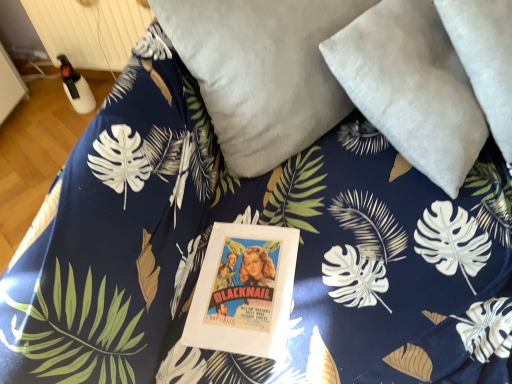
In order to click on suede-like gray pillow at upper right, the first pillow positioned from the right in this screenshot , I will do `click(411, 87)`.

This screenshot has height=384, width=512. What do you see at coordinates (411, 87) in the screenshot? I see `suede-like gray pillow at upper right, the second pillow from the left` at bounding box center [411, 87].

In order to click on white plastic radiator at upper left in this screenshot , I will do `click(89, 30)`.

Locate an element on the screen. This screenshot has width=512, height=384. velvety gray pillow at upper center, marked as the 1th pillow in a left-to-right arrangement is located at coordinates (261, 72).

Is velvety gray pillow at upper center, marked as the 1th pillow in a left-to-right arrangement, oriented towards white plastic radiator at upper left?

No, velvety gray pillow at upper center, marked as the 1th pillow in a left-to-right arrangement, is not facing towards white plastic radiator at upper left.

What's the angular difference between velvety gray pillow at upper center, the second pillow in the right-to-left sequence, and white plastic radiator at upper left's facing directions?

They differ by 46.6 degrees in their facing directions.

Which object is further away from the camera taking this photo, velvety gray pillow at upper center, marked as the 1th pillow in a left-to-right arrangement, or white plastic radiator at upper left?

white plastic radiator at upper left is further from the camera.

Can you confirm if velvety gray pillow at upper center, marked as the 1th pillow in a left-to-right arrangement, is thinner than white plastic radiator at upper left?

Incorrect, the width of velvety gray pillow at upper center, marked as the 1th pillow in a left-to-right arrangement, is not less than that of white plastic radiator at upper left.

Is white plastic radiator at upper left touching suede-like gray pillow at upper right, the second pillow from the left?

No, white plastic radiator at upper left is not beside suede-like gray pillow at upper right, the second pillow from the left.

How distant is white plastic radiator at upper left from suede-like gray pillow at upper right, the first pillow positioned from the right?

They are 1.13 meters apart.

Does point (96, 38) lie in front of point (403, 120)?

That is False.

Between white plastic radiator at upper left and suede-like gray pillow at upper right, the first pillow positioned from the right, which one has larger width?

suede-like gray pillow at upper right, the first pillow positioned from the right.

Is point (90, 7) closer or farther from the camera than point (279, 46)?

Clearly, point (90, 7) is more distant from the camera than point (279, 46).

Considering the relative sizes of white plastic radiator at upper left and velvety gray pillow at upper center, the second pillow in the right-to-left sequence, in the image provided, is white plastic radiator at upper left shorter than velvety gray pillow at upper center, the second pillow in the right-to-left sequence,?

Correct, white plastic radiator at upper left is not as tall as velvety gray pillow at upper center, the second pillow in the right-to-left sequence.

Locate an element on the screen. This screenshot has width=512, height=384. radiator lying behind the velvety gray pillow at upper center, marked as the 1th pillow in a left-to-right arrangement is located at coordinates (89, 30).

Is white plastic radiator at upper left inside or outside of velvety gray pillow at upper center, marked as the 1th pillow in a left-to-right arrangement?

white plastic radiator at upper left is not enclosed by velvety gray pillow at upper center, marked as the 1th pillow in a left-to-right arrangement.

From a real-world perspective, is suede-like gray pillow at upper right, the second pillow from the left, on white plastic radiator at upper left?

Correct, in the physical world, suede-like gray pillow at upper right, the second pillow from the left, is higher than white plastic radiator at upper left.

Who is shorter, suede-like gray pillow at upper right, the second pillow from the left, or white plastic radiator at upper left?

white plastic radiator at upper left is shorter.

Is suede-like gray pillow at upper right, the first pillow positioned from the right, facing away from white plastic radiator at upper left?

suede-like gray pillow at upper right, the first pillow positioned from the right, is not turned away from white plastic radiator at upper left.

Are suede-like gray pillow at upper right, the first pillow positioned from the right, and white plastic radiator at upper left making contact?

No, suede-like gray pillow at upper right, the first pillow positioned from the right, is not with white plastic radiator at upper left.

From the image's perspective, is velvety gray pillow at upper center, the second pillow in the right-to-left sequence, on top of suede-like gray pillow at upper right, the second pillow from the left?

Yes.

Which object is positioned more to the right, velvety gray pillow at upper center, the second pillow in the right-to-left sequence, or suede-like gray pillow at upper right, the second pillow from the left?

suede-like gray pillow at upper right, the second pillow from the left.

Considering the relative sizes of velvety gray pillow at upper center, marked as the 1th pillow in a left-to-right arrangement, and suede-like gray pillow at upper right, the first pillow positioned from the right, in the image provided, is velvety gray pillow at upper center, marked as the 1th pillow in a left-to-right arrangement, smaller than suede-like gray pillow at upper right, the first pillow positioned from the right,?

No, velvety gray pillow at upper center, marked as the 1th pillow in a left-to-right arrangement, is not smaller than suede-like gray pillow at upper right, the first pillow positioned from the right.

In the scene shown: What's the angular difference between velvety gray pillow at upper center, marked as the 1th pillow in a left-to-right arrangement, and suede-like gray pillow at upper right, the first pillow positioned from the right,'s facing directions?

13.2 degrees separate the facing orientations of velvety gray pillow at upper center, marked as the 1th pillow in a left-to-right arrangement, and suede-like gray pillow at upper right, the first pillow positioned from the right.

Considering the relative sizes of suede-like gray pillow at upper right, the first pillow positioned from the right, and velvety gray pillow at upper center, the second pillow in the right-to-left sequence, in the image provided, is suede-like gray pillow at upper right, the first pillow positioned from the right, bigger than velvety gray pillow at upper center, the second pillow in the right-to-left sequence,?

No.

Which is further, (x=426, y=140) or (x=284, y=143)?

Positioned behind is point (x=284, y=143).

Consider the image. How different are the orientations of suede-like gray pillow at upper right, the first pillow positioned from the right, and velvety gray pillow at upper center, the second pillow in the right-to-left sequence, in degrees?

13.2 degrees.

Is suede-like gray pillow at upper right, the second pillow from the left, not near velvety gray pillow at upper center, marked as the 1th pillow in a left-to-right arrangement?

They are positioned close to each other.

Find the location of `radiator below the velvety gray pillow at upper center, marked as the 1th pillow in a left-to-right arrangement (from a real-world perspective)`. radiator below the velvety gray pillow at upper center, marked as the 1th pillow in a left-to-right arrangement (from a real-world perspective) is located at coordinates (89, 30).

In the image, there is a suede-like gray pillow at upper right, the second pillow from the left. Identify the location of radiator above it (from the image's perspective). (89, 30).

Based on their spatial positions, is white plastic radiator at upper left or suede-like gray pillow at upper right, the first pillow positioned from the right, closer to velvety gray pillow at upper center, the second pillow in the right-to-left sequence?

suede-like gray pillow at upper right, the first pillow positioned from the right, is positioned closer to the anchor velvety gray pillow at upper center, the second pillow in the right-to-left sequence.

When comparing their distances from white plastic radiator at upper left, does suede-like gray pillow at upper right, the first pillow positioned from the right, or velvety gray pillow at upper center, the second pillow in the right-to-left sequence, seem closer?

velvety gray pillow at upper center, the second pillow in the right-to-left sequence.

Estimate the real-world distances between objects in this image. Which object is closer to suede-like gray pillow at upper right, the first pillow positioned from the right, velvety gray pillow at upper center, the second pillow in the right-to-left sequence, or white plastic radiator at upper left?

The object closer to suede-like gray pillow at upper right, the first pillow positioned from the right, is velvety gray pillow at upper center, the second pillow in the right-to-left sequence.

Based on their spatial positions, is velvety gray pillow at upper center, marked as the 1th pillow in a left-to-right arrangement, or suede-like gray pillow at upper right, the second pillow from the left, closer to white plastic radiator at upper left?

Among the two, velvety gray pillow at upper center, marked as the 1th pillow in a left-to-right arrangement, is located nearer to white plastic radiator at upper left.

When comparing their distances from velvety gray pillow at upper center, the second pillow in the right-to-left sequence, does suede-like gray pillow at upper right, the second pillow from the left, or white plastic radiator at upper left seem further?

white plastic radiator at upper left lies further to velvety gray pillow at upper center, the second pillow in the right-to-left sequence, than the other object.

Estimate the real-world distances between objects in this image. Which object is closer to suede-like gray pillow at upper right, the first pillow positioned from the right, white plastic radiator at upper left or velvety gray pillow at upper center, marked as the 1th pillow in a left-to-right arrangement?

velvety gray pillow at upper center, marked as the 1th pillow in a left-to-right arrangement, is positioned closer to the anchor suede-like gray pillow at upper right, the first pillow positioned from the right.

Locate an element on the screen. Image resolution: width=512 pixels, height=384 pixels. pillow between white plastic radiator at upper left and suede-like gray pillow at upper right, the first pillow positioned from the right is located at coordinates (261, 72).